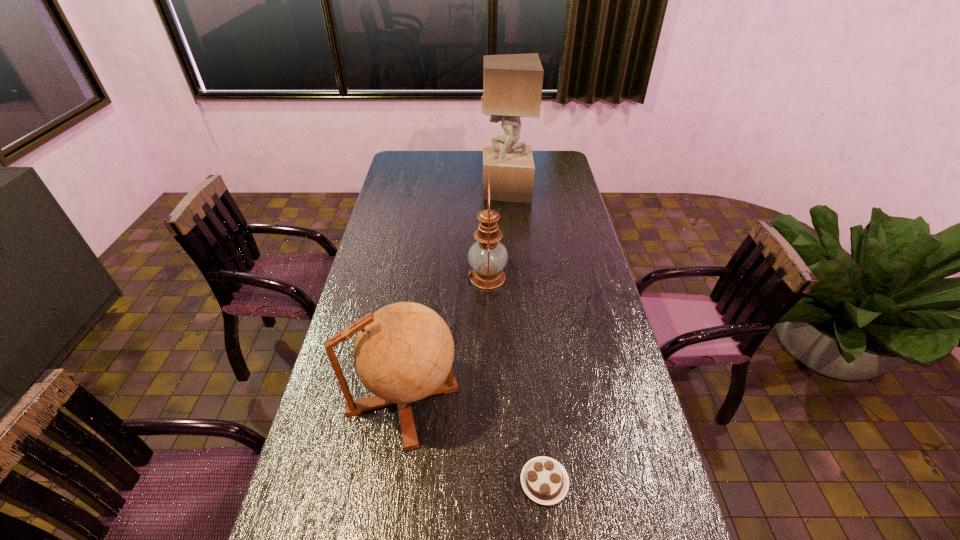
At what (x,y) coordinates should I click in order to perform the action: click on vacant area that satisfies the following two spatial constraints: 1. on the surface of the globe; 2. on the back side of the shortest object. Please return your answer as a coordinate pair (x, y). Looking at the image, I should click on (391, 482).

You are a GUI agent. You are given a task and a screenshot of the screen. Output one action in this format:
    pyautogui.click(x=<x>, y=<y>)
    Task: Click on the blank space that satisfies the following two spatial constraints: 1. on the front-facing side of the tallest object; 2. on the front side of the third nearest object
    The image size is (960, 540).
    Given the screenshot: What is the action you would take?
    pyautogui.click(x=513, y=277)